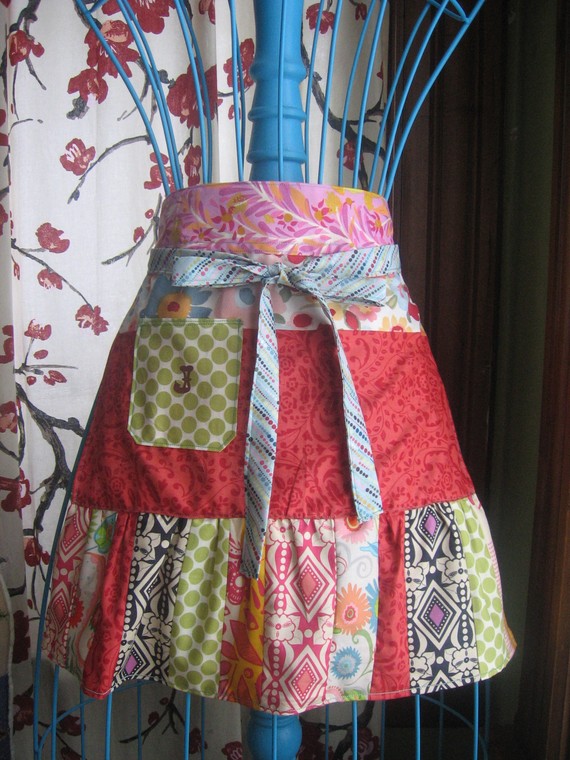
Locate an element on the screen. curtain is located at coordinates (65, 135).